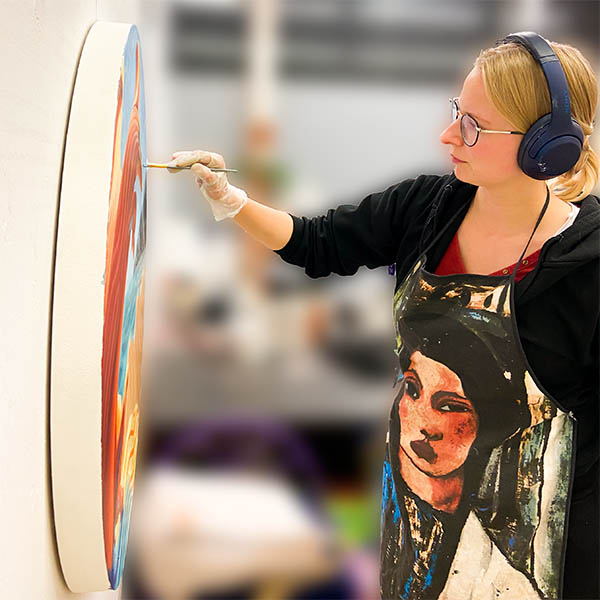
At what (x,y) coordinates should I click in order to perform the action: click on painting. Please return your answer as a coordinate pair (x, y). Looking at the image, I should click on (127, 221).